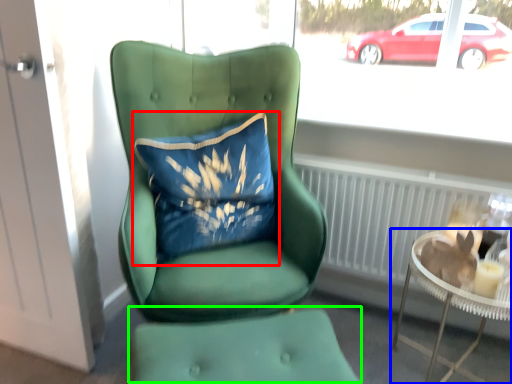
Question: Which object is positioned closest to pillow (highlighted by a red box)? Select from table (highlighted by a blue box) and footrest (highlighted by a green box).

Choices:
 (A) table
 (B) footrest

Answer: (B)